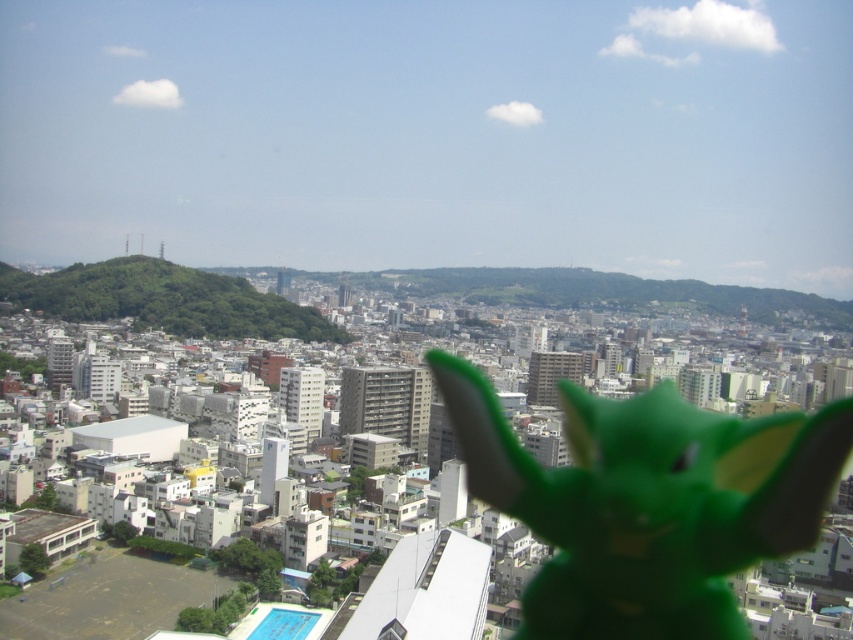
Question: Observing the image, what is the correct spatial positioning of green matte toy at center in reference to green matte hill at center?

Choices:
 (A) left
 (B) right

Answer: (B)

Question: Which of the following is the closest to the observer?

Choices:
 (A) coord(656,548)
 (B) coord(20,276)

Answer: (A)

Question: Does green matte toy at center have a larger size compared to green matte hill at center?

Choices:
 (A) no
 (B) yes

Answer: (A)

Question: Where is green matte toy at center located in relation to green matte hill at center in the image?

Choices:
 (A) right
 (B) left

Answer: (A)